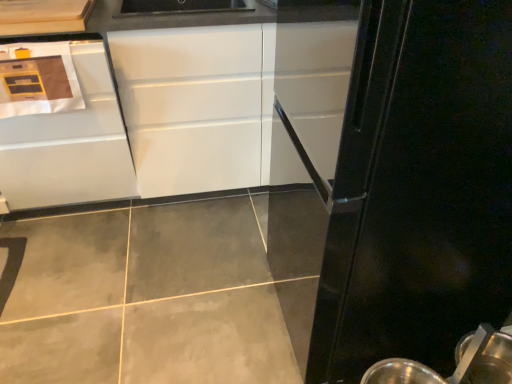
Question: Is white glossy cabinet at left, the 1th cabinetry from the left, located outside metallic silver spoon at lower right?

Choices:
 (A) yes
 (B) no

Answer: (A)

Question: From the image's perspective, is white glossy cabinet at left, the 1th cabinetry from the left, on top of metallic silver spoon at lower right?

Choices:
 (A) yes
 (B) no

Answer: (A)

Question: From a real-world perspective, is white glossy cabinet at left, the 2th cabinetry positioned from the right, physically below metallic silver spoon at lower right?

Choices:
 (A) yes
 (B) no

Answer: (B)

Question: Are white glossy cabinet at left, the 1th cabinetry from the left, and metallic silver spoon at lower right located far from each other?

Choices:
 (A) yes
 (B) no

Answer: (A)

Question: Is white glossy cabinet at left, the 1th cabinetry from the left, aimed at metallic silver spoon at lower right?

Choices:
 (A) no
 (B) yes

Answer: (A)

Question: Are white glossy cabinet at left, the 2th cabinetry positioned from the right, and metallic silver spoon at lower right making contact?

Choices:
 (A) yes
 (B) no

Answer: (B)

Question: Does black glossy refrigerator at right have a smaller size compared to white glossy cabinet at left, the 2th cabinetry positioned from the right?

Choices:
 (A) no
 (B) yes

Answer: (A)

Question: Is black glossy refrigerator at right positioned in front of white glossy cabinet at left, the 2th cabinetry positioned from the right?

Choices:
 (A) no
 (B) yes

Answer: (B)

Question: Is black glossy refrigerator at right far away from white glossy cabinet at left, the 1th cabinetry from the left?

Choices:
 (A) no
 (B) yes

Answer: (B)

Question: Is black glossy refrigerator at right thinner than white glossy cabinet at left, the 2th cabinetry positioned from the right?

Choices:
 (A) no
 (B) yes

Answer: (B)

Question: From a real-world perspective, is black glossy refrigerator at right located higher than white glossy cabinet at left, the 2th cabinetry positioned from the right?

Choices:
 (A) yes
 (B) no

Answer: (A)

Question: Does black glossy refrigerator at right have a greater width compared to white glossy cabinet at left, the 2th cabinetry positioned from the right?

Choices:
 (A) yes
 (B) no

Answer: (B)

Question: Could you tell me if metallic silver spoon at lower right is facing white glossy cabinet at left, the 2th cabinetry positioned from the right?

Choices:
 (A) yes
 (B) no

Answer: (B)